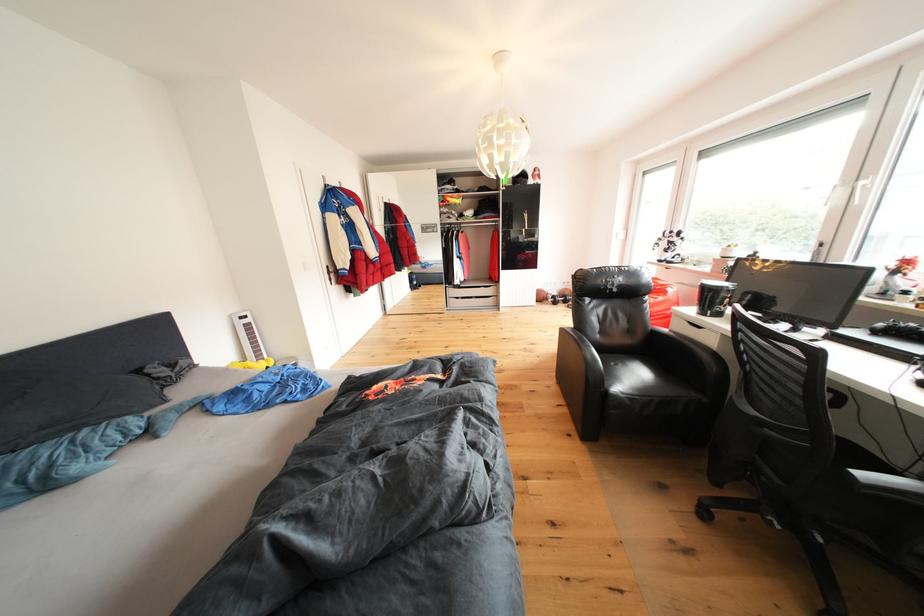
Describe the element at coordinates (628, 374) in the screenshot. This screenshot has width=924, height=616. I see `the black mesh sitting surface` at that location.